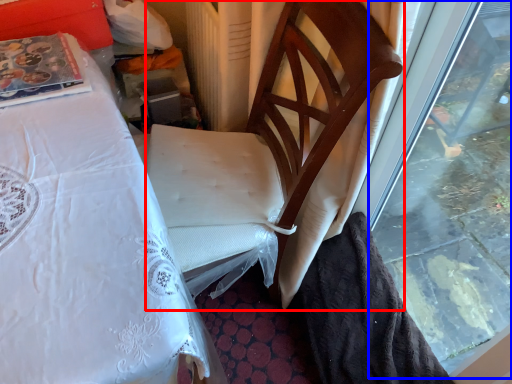
Question: Which object appears farthest to the camera in this image, chair (highlighted by a red box) or window (highlighted by a blue box)?

Choices:
 (A) chair
 (B) window

Answer: (A)